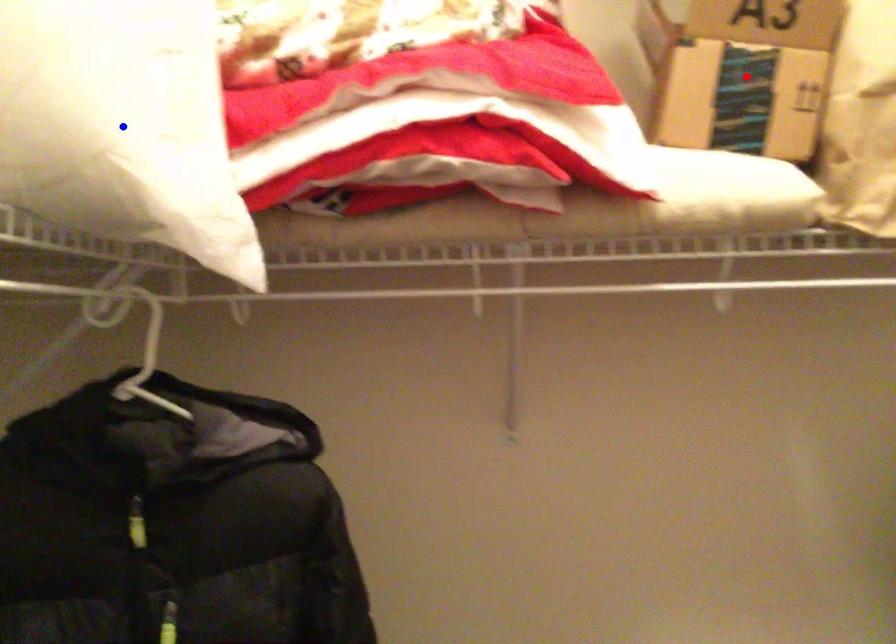
Question: Two points are marked on the image. Which point is closer to the camera?

Choices:
 (A) Blue point is closer.
 (B) Red point is closer.

Answer: (A)